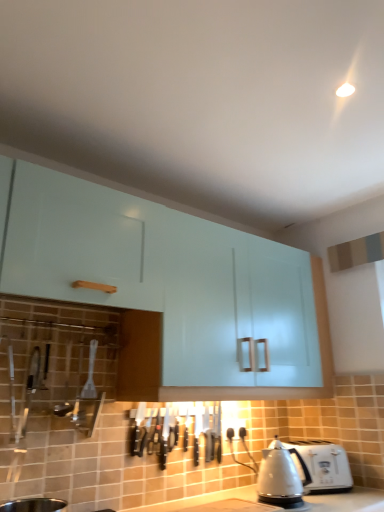
Question: From a real-world perspective, is satin silver kettle at lower right positioned above or below white plastic toaster at lower right?

Choices:
 (A) below
 (B) above

Answer: (B)

Question: Considering the positions of point (278, 485) and point (327, 458), is point (278, 485) closer or farther from the camera than point (327, 458)?

Choices:
 (A) closer
 (B) farther

Answer: (A)

Question: Which is farther from the glossy white cabinet at upper center?

Choices:
 (A) satin silver kettle at lower right
 (B) white plastic toaster at lower right

Answer: (A)

Question: Estimate the real-world distances between objects in this image. Which object is farther from the glossy white cabinet at upper center?

Choices:
 (A) satin silver kettle at lower right
 (B) white plastic toaster at lower right

Answer: (A)